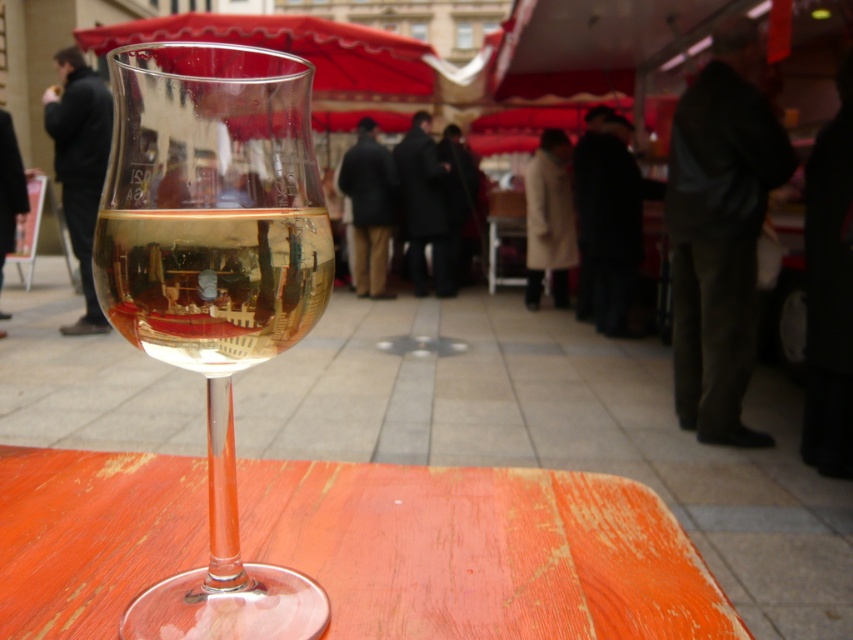
Question: Is clear glass wine at center to the left of red fabric canopy at upper center from the viewer's perspective?

Choices:
 (A) yes
 (B) no

Answer: (B)

Question: Does clear glass wine glass at center have a smaller size compared to clear glass wine at center?

Choices:
 (A) no
 (B) yes

Answer: (A)

Question: Which of the following is the closest to the observer?

Choices:
 (A) clear glass wine glass at center
 (B) clear glass wine at center

Answer: (A)

Question: Based on their relative distances, which object is nearer to the red fabric canopy at upper center?

Choices:
 (A) clear glass wine at center
 (B) clear glass wine glass at center
 (C) wooden table at center

Answer: (C)

Question: Among these points, which one is farthest from the camera?

Choices:
 (A) (206, 276)
 (B) (198, 308)
 (C) (90, 589)

Answer: (C)

Question: Can you confirm if wooden table at center is positioned above clear glass wine at center?

Choices:
 (A) yes
 (B) no

Answer: (B)